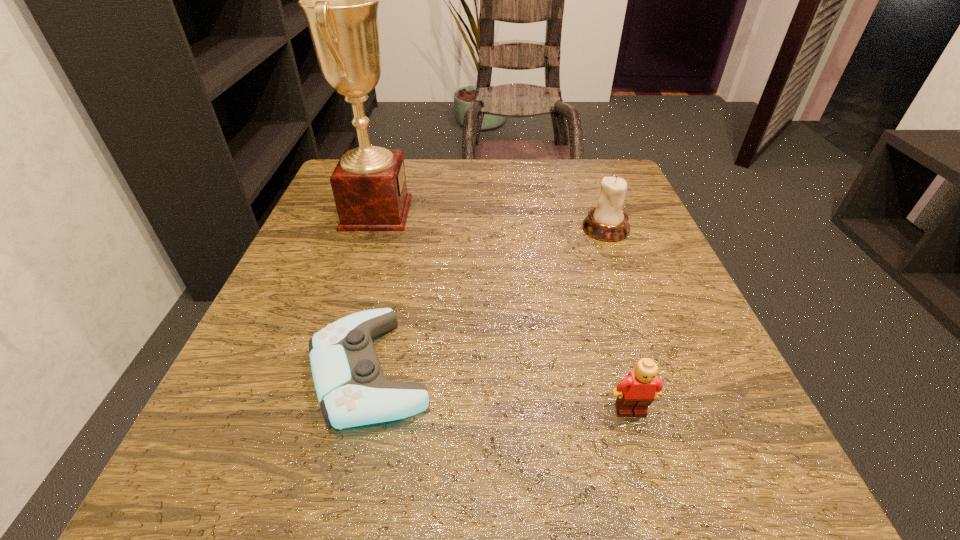
I want to click on unoccupied position between the trophy cup and the Lego, so click(x=504, y=312).

At what (x,y) coordinates should I click in order to perform the action: click on blank region between the second tallest object and the third tallest object. Please return your answer as a coordinate pair (x, y). Looking at the image, I should click on (618, 320).

Locate an element on the screen. vacant region between the control and the tallest object is located at coordinates (373, 292).

The height and width of the screenshot is (540, 960). What are the coordinates of `blank region between the trophy cup and the third tallest object` in the screenshot? It's located at (504, 312).

You are a GUI agent. You are given a task and a screenshot of the screen. Output one action in this format:
    pyautogui.click(x=<x>, y=<y>)
    Task: Click on the free space between the third tallest object and the candle holder
    
    Given the screenshot: What is the action you would take?
    pyautogui.click(x=618, y=320)

Where is `blank region between the tallest object and the shortest object`? This screenshot has width=960, height=540. blank region between the tallest object and the shortest object is located at coordinates (373, 292).

The width and height of the screenshot is (960, 540). I want to click on vacant point located between the tallest object and the candle holder, so click(x=492, y=221).

This screenshot has width=960, height=540. What are the coordinates of `empty space that is in between the candle holder and the second shortest object` in the screenshot? It's located at (618, 320).

Find the location of a particular element. blank region between the Lego and the tallest object is located at coordinates (504, 312).

Select which object appears as the third closest to the tallest object. Please provide its 2D coordinates. Your answer should be formatted as a tuple, i.e. [(x, y)], where the tuple contains the x and y coordinates of a point satisfying the conditions above.

[(636, 392)]